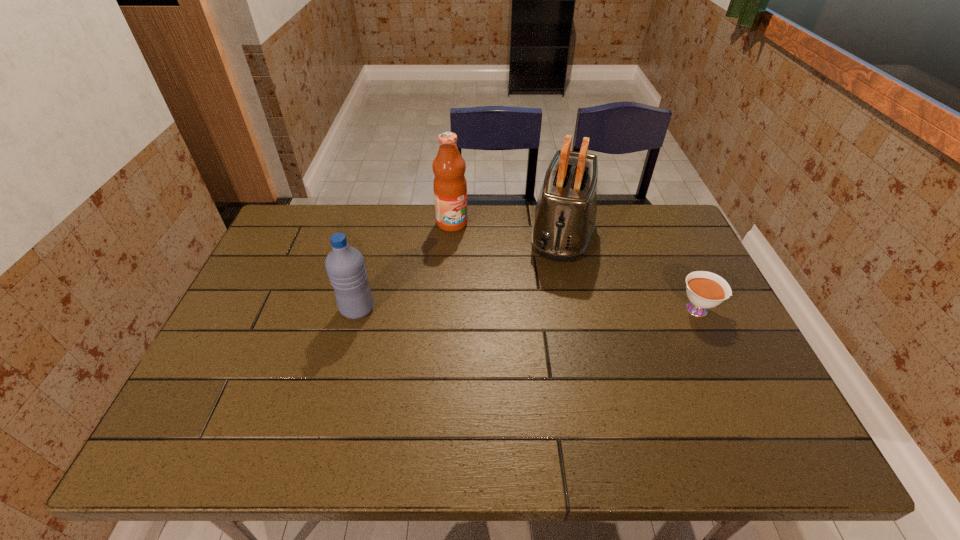
At what (x,y) coordinates should I click in order to perform the action: click on free space at the near left corner of the desktop. Please return your answer as a coordinate pair (x, y). Looking at the image, I should click on (187, 402).

In order to click on free region at the far right corner of the desktop in this screenshot , I will do `click(659, 244)`.

Find the location of a particular element. free point between the second object from right to left and the fruit juice is located at coordinates (507, 228).

In order to click on vacant area that lies between the toaster and the teacup in this screenshot , I will do pyautogui.click(x=631, y=272).

Identify the location of unoccupied area between the third object from left to right and the second object from left to right. (507, 228).

At what (x,y) coordinates should I click in order to perform the action: click on free space that is in between the water bottle and the second object from right to left. Please return your answer as a coordinate pair (x, y). The width and height of the screenshot is (960, 540). Looking at the image, I should click on (460, 272).

Find the location of a particular element. This screenshot has width=960, height=540. free space between the toaster and the leftmost object is located at coordinates (460, 272).

Find the location of a particular element. Image resolution: width=960 pixels, height=540 pixels. vacant space that is in between the teacup and the fruit juice is located at coordinates (576, 266).

The image size is (960, 540). I want to click on vacant area that lies between the water bottle and the rightmost object, so click(528, 309).

Locate an element on the screen. free space between the fruit juice and the shortest object is located at coordinates (576, 266).